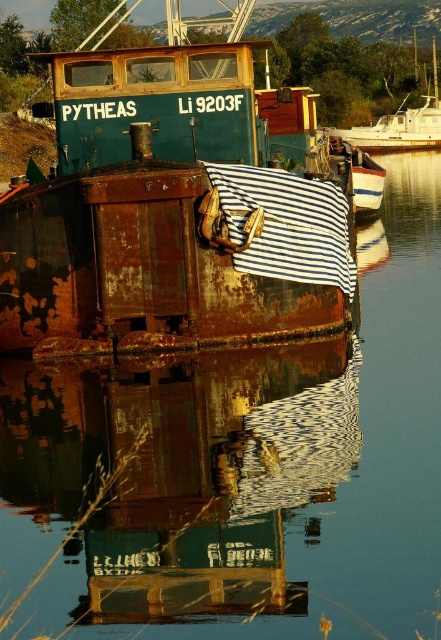
You are standing at the origin point of the image coordinate system, which is the bottom left corner. You want to locate the rusty metal boat at lower center. What are the coordinates of its position?

The coordinates of the rusty metal boat at lower center are at point (x=189, y=496).

Based on the photo, you are a marine inspector assessing the docking area. You need to determine if the rusty metal boat at lower center can fit into a space designed for the white glossy boat at right. Based on their sizes, what is your conclusion?

The rusty metal boat at lower center is smaller than the white glossy boat at right, so it can fit into the space designed for the white glossy boat at right.